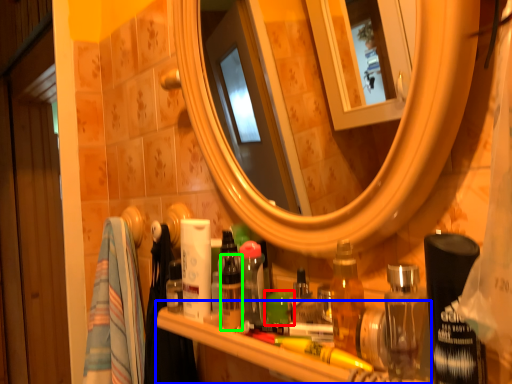
Question: Which is nearer to the toiletry (highlighted by a red box)? counter (highlighted by a blue box) or toiletry (highlighted by a green box).

Choices:
 (A) counter
 (B) toiletry

Answer: (B)